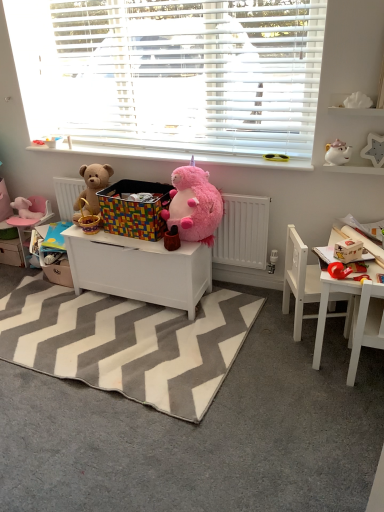
Image resolution: width=384 pixels, height=512 pixels. Identify the location of free space in front of white plastic chair at right, the 2th chair from the back. (360, 406).